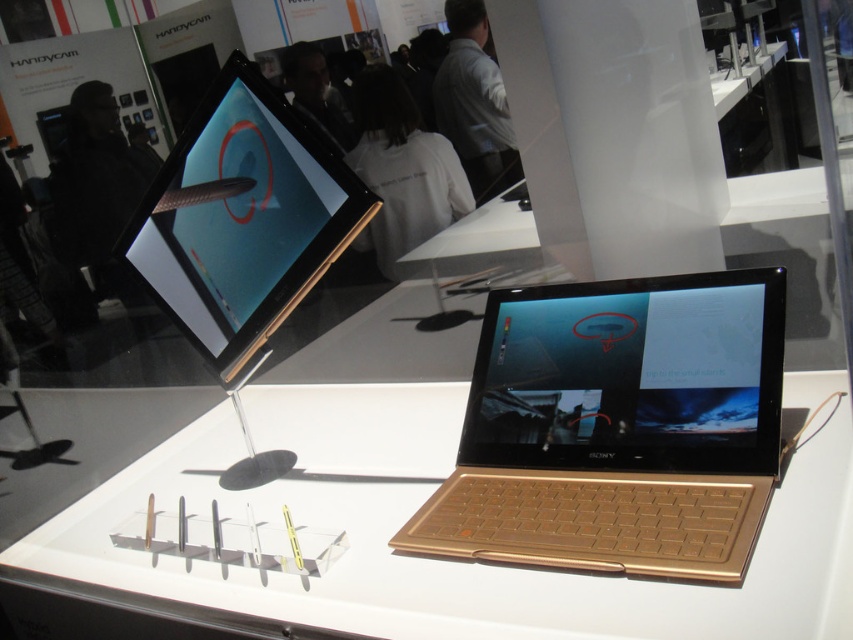
Can you confirm if gold metallic laptop at center is positioned above gold metallic laptop at upper center?

Incorrect, gold metallic laptop at center is not positioned above gold metallic laptop at upper center.

Between point (695, 570) and point (229, 371), which one is positioned in front?

Point (695, 570)

Image resolution: width=853 pixels, height=640 pixels. What are the coordinates of `gold metallic laptop at center` in the screenshot? It's located at (618, 428).

You are a GUI agent. You are given a task and a screenshot of the screen. Output one action in this format:
    pyautogui.click(x=<x>, y=<y>)
    Task: Click on the gold metallic table at center
    The height and width of the screenshot is (640, 853).
    Given the screenshot: What is the action you would take?
    pyautogui.click(x=457, y=561)

Between gold metallic table at center and gold metallic laptop at center, which one is positioned higher?

gold metallic laptop at center

The width and height of the screenshot is (853, 640). What do you see at coordinates (457, 561) in the screenshot?
I see `gold metallic table at center` at bounding box center [457, 561].

Identify the location of gold metallic table at center. (457, 561).

How distant is gold metallic table at center from gold metallic laptop at upper center?

gold metallic table at center is 17.27 inches away from gold metallic laptop at upper center.

Between point (802, 637) and point (192, 241), which one is positioned in front?

Point (802, 637) is in front.

What do you see at coordinates (457, 561) in the screenshot? Image resolution: width=853 pixels, height=640 pixels. I see `gold metallic table at center` at bounding box center [457, 561].

Identify the location of gold metallic table at center. This screenshot has height=640, width=853. (457, 561).